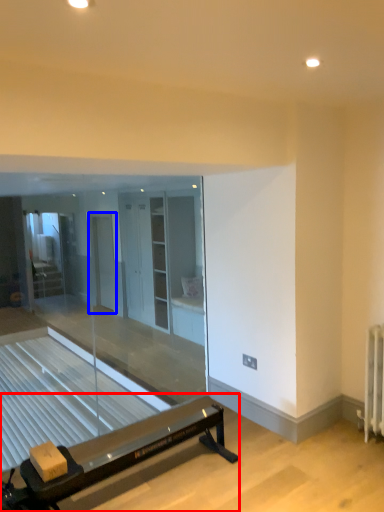
Question: Which point is closer to the camera, furniture (highlighted by a red box) or screen door (highlighted by a blue box)?

Choices:
 (A) furniture
 (B) screen door

Answer: (A)